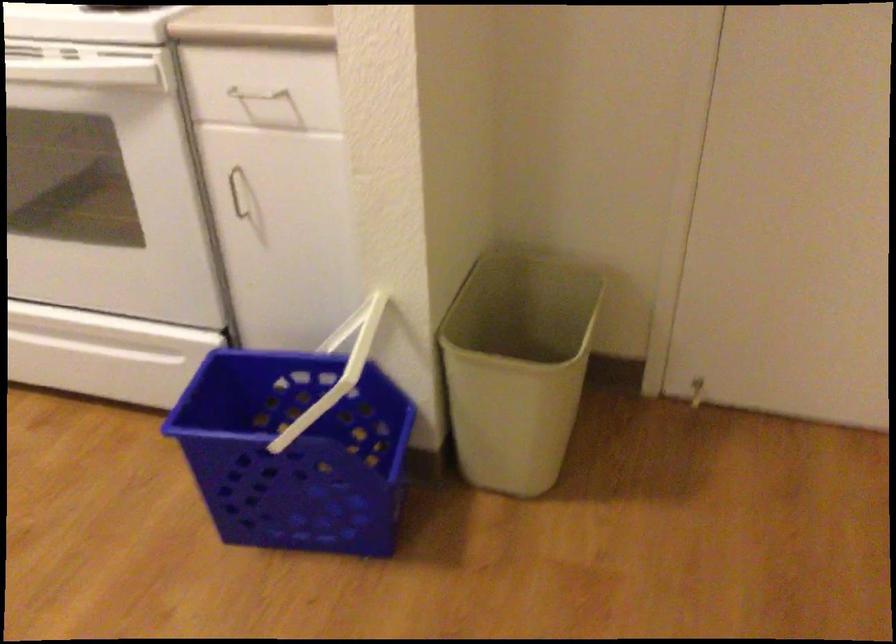
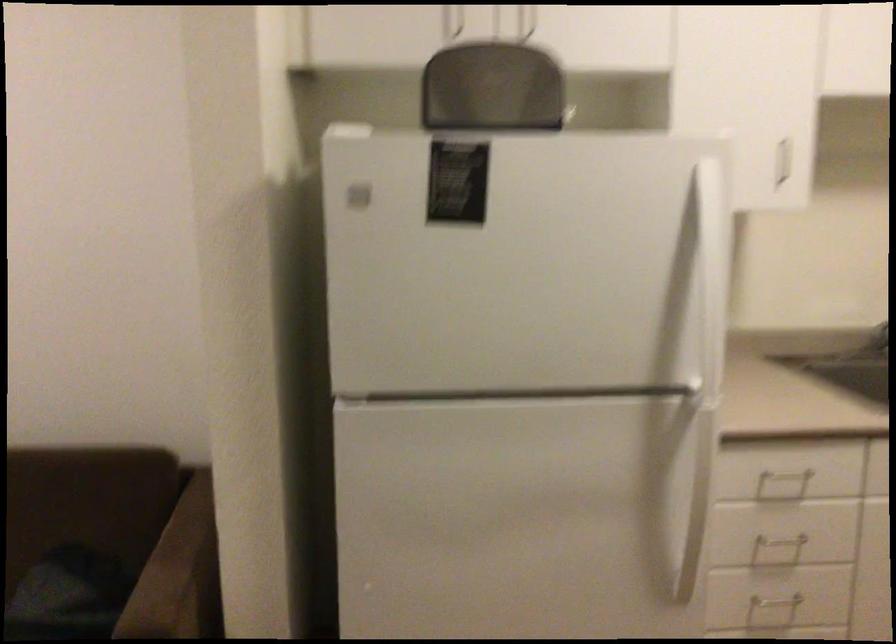
Question: The camera is either moving clockwise (left) or counter-clockwise (right) around the object. The first image is from the beginning of the video and the second image is from the end. Is the camera moving left or right when shooting the video?

Choices:
 (A) Left
 (B) Right

Answer: (B)